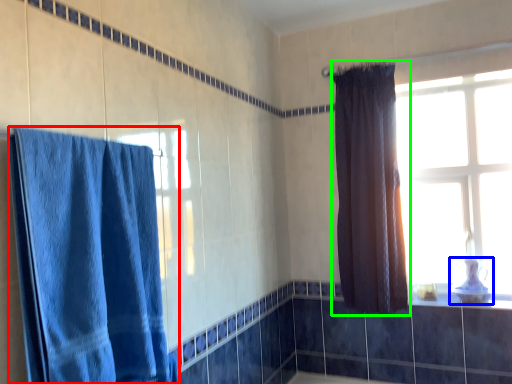
Question: Which object is the closest to the curtain (highlighted by a red box)? Choose among these: sink (highlighted by a blue box) or curtain (highlighted by a green box).

Choices:
 (A) sink
 (B) curtain

Answer: (B)